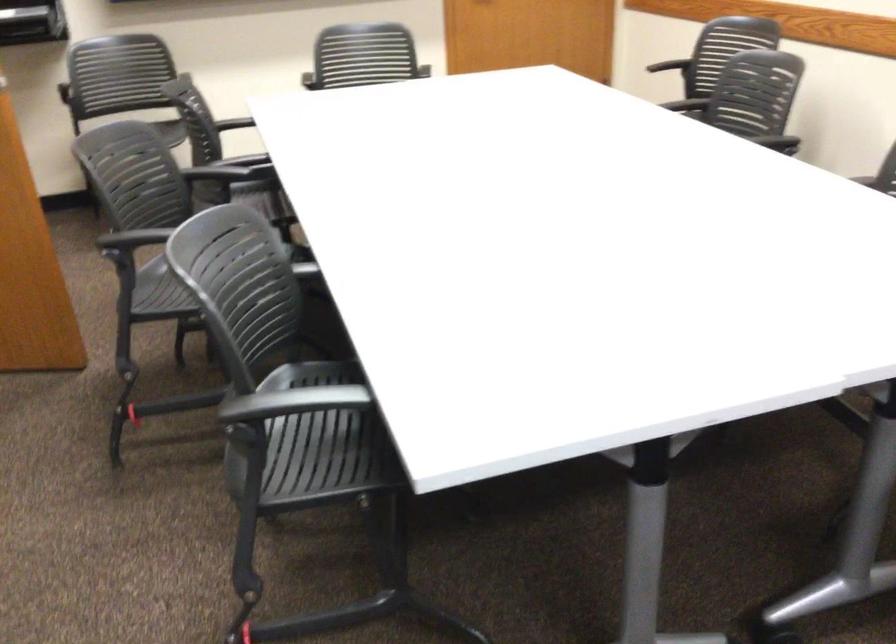
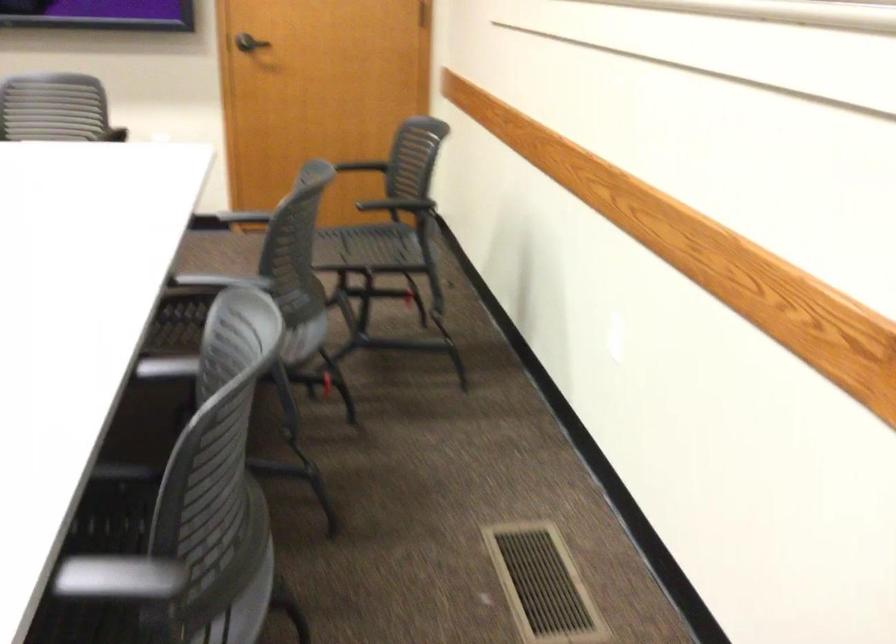
Where in the second image is the point corresponding to point (745, 142) from the first image?

(220, 281)